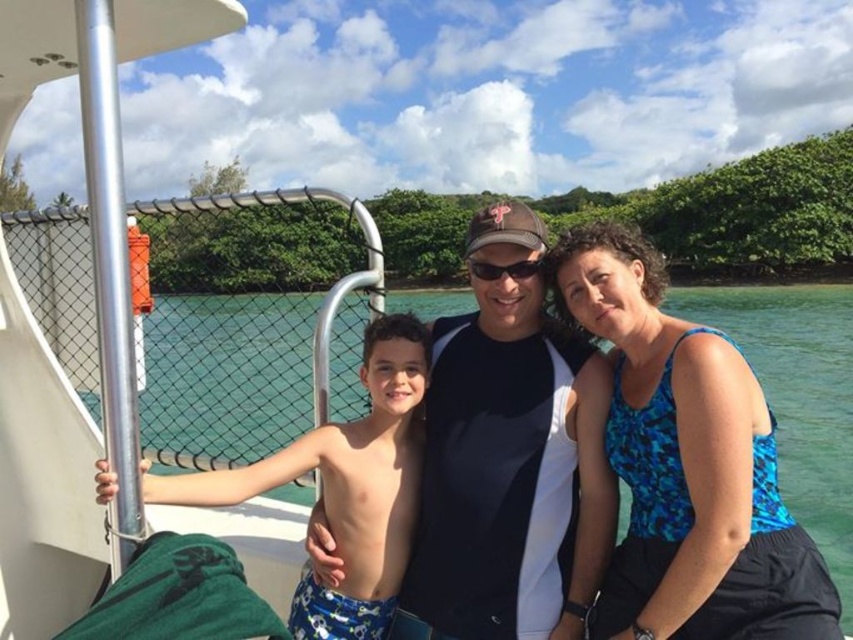
Between blue printed tank top at center and blue printed swim trunks at left, which one is positioned higher?

blue printed tank top at center

Locate an element on the screen. This screenshot has height=640, width=853. blue printed tank top at center is located at coordinates (688, 465).

Does black fabric shirt at center have a lesser height compared to blue printed tank top at center?

No, black fabric shirt at center is not shorter than blue printed tank top at center.

Between point (440, 634) and point (639, 403), which one is positioned in front?

Point (639, 403) is in front.

Image resolution: width=853 pixels, height=640 pixels. I want to click on black fabric shirt at center, so click(x=509, y=458).

Can you confirm if black fabric shirt at center is bigger than blue printed swim trunks at left?

Incorrect, black fabric shirt at center is not larger than blue printed swim trunks at left.

Between point (434, 440) and point (111, 477), which one is positioned behind?

Point (434, 440)

This screenshot has height=640, width=853. In order to click on black fabric shirt at center in this screenshot , I will do `click(509, 458)`.